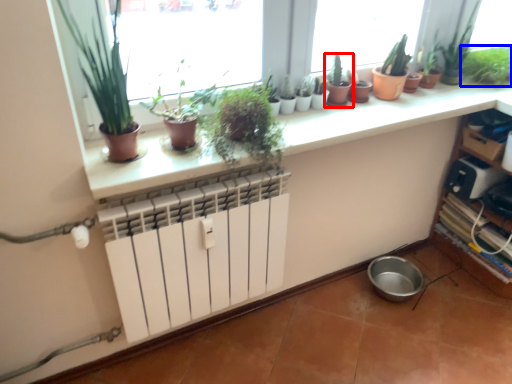
Question: Which object appears closest to the camera in this image, houseplant (highlighted by a red box) or houseplant (highlighted by a blue box)?

Choices:
 (A) houseplant
 (B) houseplant

Answer: (A)